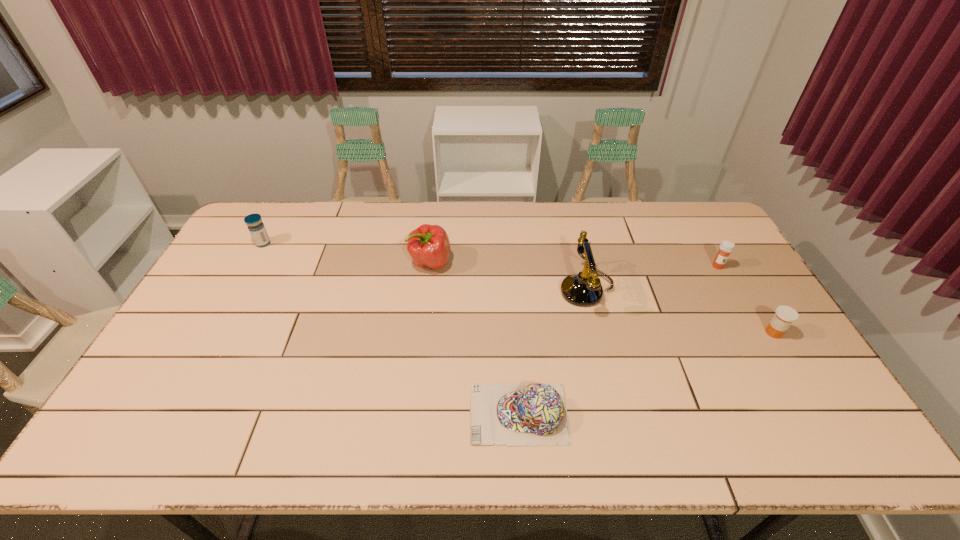
The image size is (960, 540). In the image, there is a desktop. Find the location of `vacant region at the right edge`. vacant region at the right edge is located at coordinates (709, 255).

Locate an element on the screen. The width and height of the screenshot is (960, 540). vacant area at the far right corner is located at coordinates (703, 235).

You are a GUI agent. You are given a task and a screenshot of the screen. Output one action in this format:
    pyautogui.click(x=<x>, y=<y>)
    Task: Click on the vacant space that's between the tallest object and the nearest medicine
    The width and height of the screenshot is (960, 540).
    Given the screenshot: What is the action you would take?
    pyautogui.click(x=680, y=312)

Identify the location of free space between the pepper and the fifth object from left to right. (574, 264).

This screenshot has height=540, width=960. I want to click on free space between the telephone and the fifth shortest object, so click(509, 276).

At what (x,y) coordinates should I click in order to perform the action: click on empty location between the pepper and the tallest object. Please return your answer as a coordinate pair (x, y). Image resolution: width=960 pixels, height=540 pixels. Looking at the image, I should click on (509, 276).

This screenshot has height=540, width=960. Identify the location of vacant space that is in between the tallest object and the nearest object. (553, 352).

Locate an element on the screen. free space between the fifth farthest object and the pepper is located at coordinates (602, 298).

Locate an element on the screen. The width and height of the screenshot is (960, 540). free space that is in between the fifth object from left to right and the leftmost medicine is located at coordinates [491, 255].

Find the location of a particular element. The height and width of the screenshot is (540, 960). free space between the second object from right to left and the second nearest object is located at coordinates (746, 299).